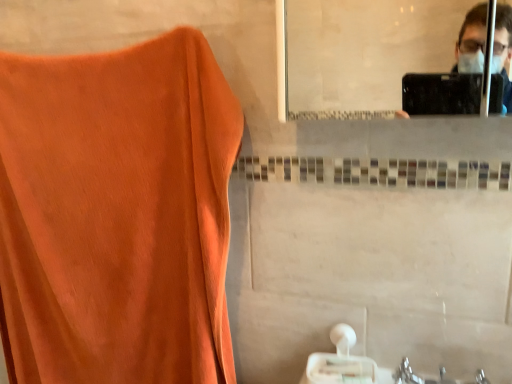
Question: In the image, is orange fabric at left on the left side or the right side of white matte tissue at lower center?

Choices:
 (A) left
 (B) right

Answer: (A)

Question: Considering their positions, is orange fabric at left located in front of or behind white matte tissue at lower center?

Choices:
 (A) front
 (B) behind

Answer: (A)

Question: Do you think orange fabric at left is within white matte tissue at lower center, or outside of it?

Choices:
 (A) outside
 (B) inside

Answer: (A)

Question: From a real-world perspective, is white matte tissue at lower center physically located above or below orange fabric at left?

Choices:
 (A) below
 (B) above

Answer: (A)

Question: From their relative heights in the image, would you say white matte tissue at lower center is taller or shorter than orange fabric at left?

Choices:
 (A) short
 (B) tall

Answer: (A)

Question: Is white matte tissue at lower center inside the boundaries of orange fabric at left, or outside?

Choices:
 (A) outside
 (B) inside

Answer: (A)

Question: From the image's perspective, is white matte tissue at lower center located above or below orange fabric at left?

Choices:
 (A) above
 (B) below

Answer: (B)